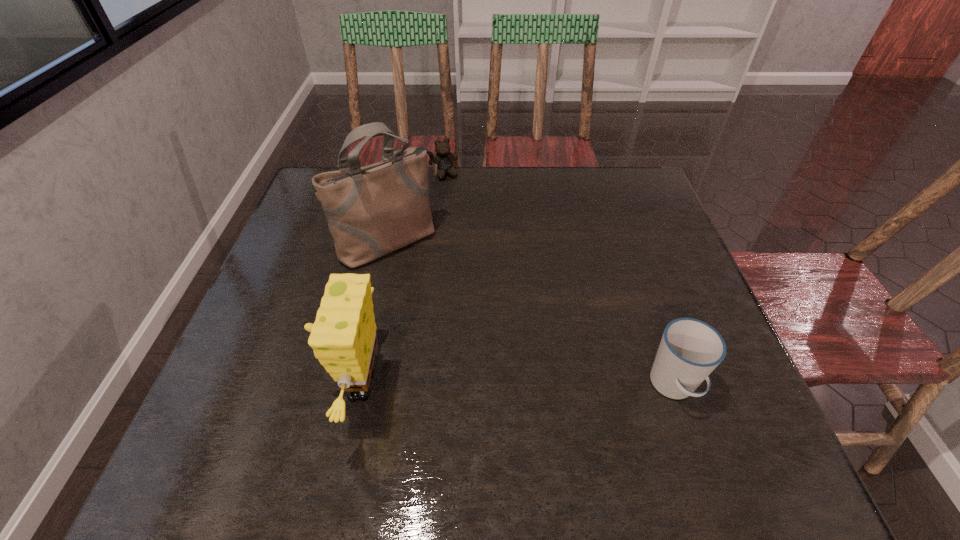
The width and height of the screenshot is (960, 540). In order to click on vacant space in between the third shortest object and the teddy bear in this screenshot , I will do `click(400, 280)`.

You are a GUI agent. You are given a task and a screenshot of the screen. Output one action in this format:
    pyautogui.click(x=<x>, y=<y>)
    Task: Click on the vacant space that's between the cup and the tallest object
    The height and width of the screenshot is (540, 960).
    Given the screenshot: What is the action you would take?
    pyautogui.click(x=531, y=314)

Locate an element on the screen. The height and width of the screenshot is (540, 960). unoccupied area between the cup and the tallest object is located at coordinates (531, 314).

This screenshot has width=960, height=540. I want to click on unoccupied position between the third shortest object and the shortest object, so click(400, 280).

I want to click on object that can be found as the third closest to the farthest object, so click(x=690, y=349).

Identify which object is the closest to the tallest object. Please provide its 2D coordinates. Your answer should be formatted as a tuple, i.e. [(x, y)], where the tuple contains the x and y coordinates of a point satisfying the conditions above.

[(444, 158)]